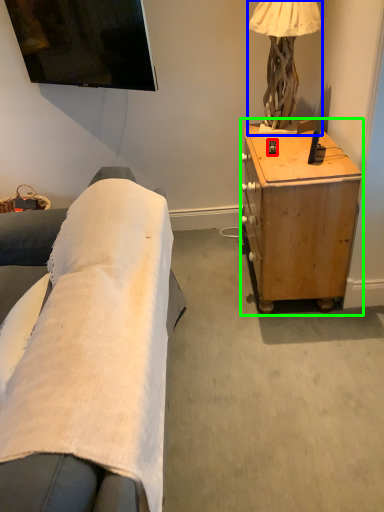
Question: Estimate the real-world distances between objects in this image. Which object is farther from remote control (highlighted by a red box), lamp (highlighted by a blue box) or desk (highlighted by a green box)?

Choices:
 (A) lamp
 (B) desk

Answer: (B)